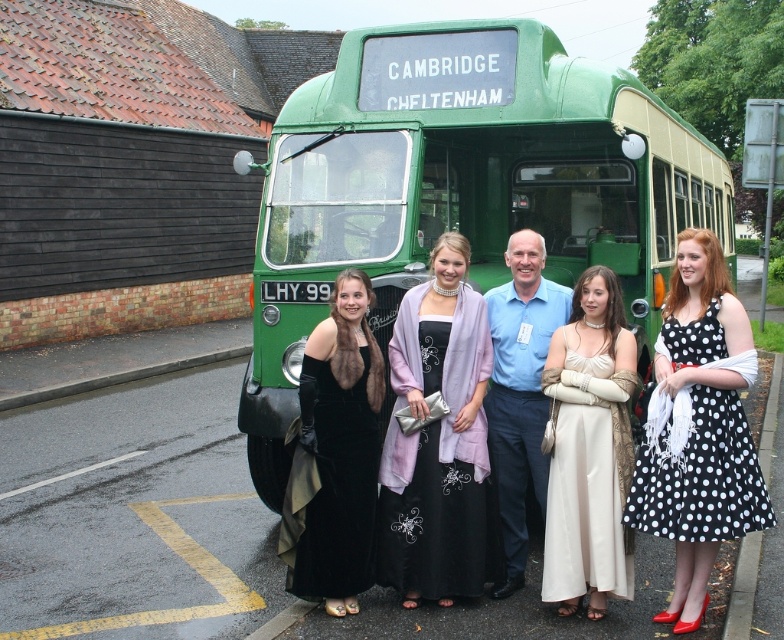
You are a photographer standing in front of the green polished wood decker bus at center and the green metal pole at upper right. You want to capture a photo that includes both objects in the frame. Considering their heights, which object will appear taller in the photo?

The green metal pole at upper right will appear taller in the photo because the green polished wood decker bus at center has a lesser height compared to green metal pole at upper right.

You are a photographer at the scene and want to ensure both the matte cream dress at center and the velvet black dress at center are fully visible in the photo. Which dress might require adjusting the camera angle to avoid cropping the hemline?

The velvet black dress at center is longer than the matte cream dress at center, so adjusting the camera angle might be necessary to ensure its full length is visible without cropping the hemline.

You are a photographer trying to capture the entire group of people standing in front of the green polished wood decker bus at center and the green metal pole at upper right in one frame. Based on their sizes, which object should you position closer to the camera to ensure both fit within the frame?

The green polished wood decker bus at center has a lesser width compared to the green metal pole at upper right. To fit both in the frame, position the wider green metal pole at upper right closer to the camera since it requires more space, allowing the narrower bus to fit alongside.